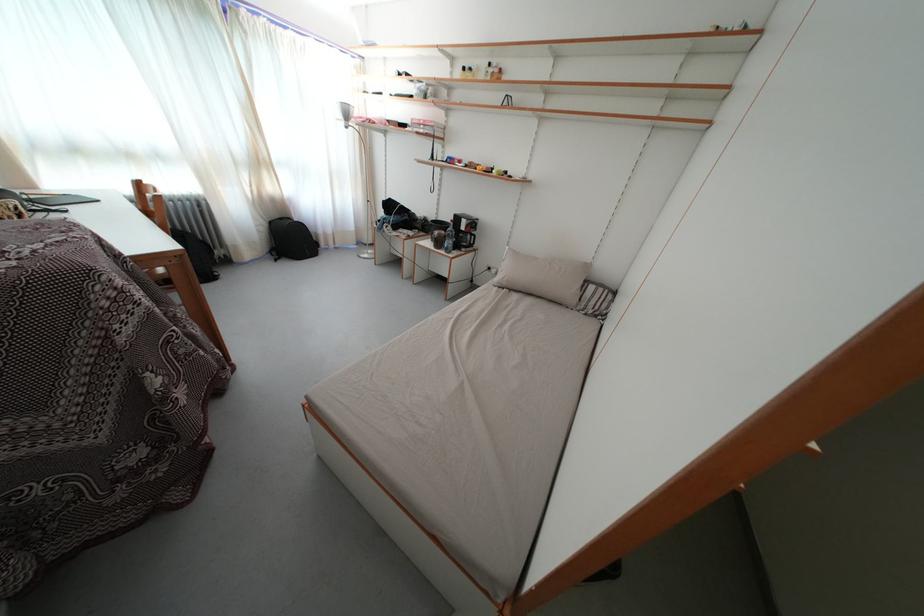
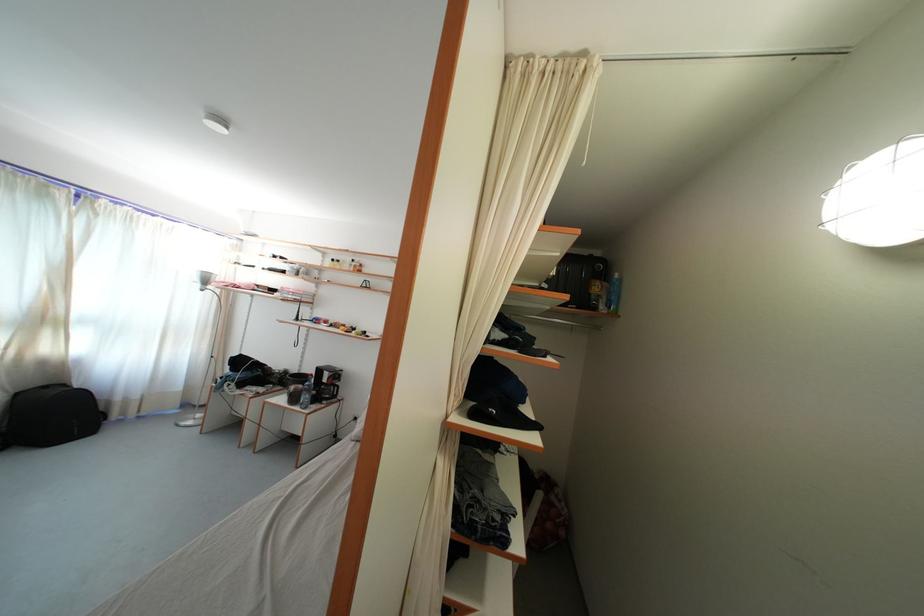
In the second image, find the point that corresponds to point 276,229 in the first image.

(23, 400)